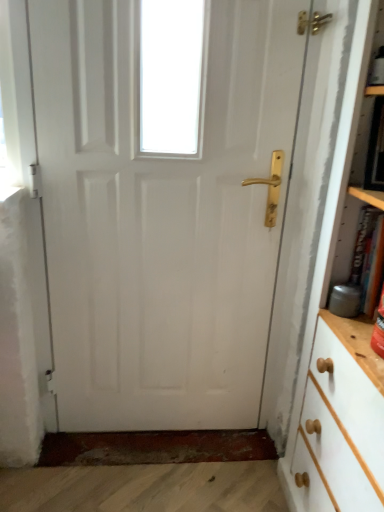
The width and height of the screenshot is (384, 512). What do you see at coordinates (339, 350) in the screenshot?
I see `white painted wood bookcase at right` at bounding box center [339, 350].

The image size is (384, 512). Identify the location of white painted wood bookcase at right. (339, 350).

Would you say white glossy door at center contains white painted wood bookcase at right?

Actually, white painted wood bookcase at right is outside white glossy door at center.

Looking at this image, from the image's perspective, does white glossy door at center appear higher than white painted wood bookcase at right?

Yes.

Is white glossy door at center not near white painted wood bookcase at right?

No, white glossy door at center is in close proximity to white painted wood bookcase at right.

How distant is white glossy door at center from white painted wood bookcase at right?

They are 19.38 inches apart.

The height and width of the screenshot is (512, 384). I want to click on door behind the white painted wood bookcase at right, so click(x=164, y=202).

Can you see white painted wood bookcase at right touching white glossy door at center?

white painted wood bookcase at right and white glossy door at center are clearly separated.

From the picture: Which object is wider, white painted wood bookcase at right or white glossy door at center?

white painted wood bookcase at right.

Can you confirm if white painted wood bookcase at right is smaller than white glossy door at center?

No, white painted wood bookcase at right is not smaller than white glossy door at center.

Which of these two, white glossy door at center or hardcover book at right, is thinner?

white glossy door at center.

Is point (205, 317) positioned after point (353, 275)?

Yes, it is behind point (353, 275).

Is white glossy door at center at the left side of hardcover book at right?

Indeed, white glossy door at center is positioned on the left side of hardcover book at right.

Which of these two, white glossy door at center or hardcover book at right, is smaller?

With smaller size is hardcover book at right.

Is hardcover book at right in front of white glossy door at center?

Yes, hardcover book at right is closer to the viewer.

In the scene shown: From a real-world perspective, is hardcover book at right positioned above or below white glossy door at center?

hardcover book at right is above white glossy door at center.

From the image's perspective, which is below, hardcover book at right or white glossy door at center?

hardcover book at right appears lower in the image.

Does hardcover book at right have a larger size compared to white glossy door at center?

Incorrect, hardcover book at right is not larger than white glossy door at center.

Which is less distant, [303,435] or [363,297]?

The point [363,297] is closer.

From a real-world perspective, does white painted wood bookcase at right sit lower than hardcover book at right?

Yes, from a real-world perspective, white painted wood bookcase at right is under hardcover book at right.

From the image's perspective, which is below, white painted wood bookcase at right or hardcover book at right?

From the image's view, white painted wood bookcase at right is below.

Consider the image. Measure the distance between hardcover book at right and white painted wood bookcase at right.

A distance of 9.62 inches exists between hardcover book at right and white painted wood bookcase at right.

In terms of height, does hardcover book at right look taller or shorter compared to white painted wood bookcase at right?

Considering their sizes, hardcover book at right has less height than white painted wood bookcase at right.

Where is `bookcase located underneath the hardcover book at right (from a real-world perspective)`? The height and width of the screenshot is (512, 384). bookcase located underneath the hardcover book at right (from a real-world perspective) is located at coordinates (339, 350).

From a real-world perspective, who is located lower, hardcover book at right or white painted wood bookcase at right?

white painted wood bookcase at right, from a real-world perspective.

Where is `bookcase on the right side of white glossy door at center`? The height and width of the screenshot is (512, 384). bookcase on the right side of white glossy door at center is located at coordinates (339, 350).

In the image, there is a white glossy door at center. Identify the location of bookcase below it (from the image's perspective). The height and width of the screenshot is (512, 384). (339, 350).

Which object lies further to the anchor point hardcover book at right, white painted wood bookcase at right or white glossy door at center?

Based on the image, white glossy door at center appears to be further to hardcover book at right.

Based on their spatial positions, is hardcover book at right or white glossy door at center further from white painted wood bookcase at right?

The object further to white painted wood bookcase at right is white glossy door at center.

Based on their spatial positions, is white glossy door at center or hardcover book at right further from white painted wood bookcase at right?

Among the two, white glossy door at center is located further to white painted wood bookcase at right.

Which object lies nearer to the anchor point white glossy door at center, white painted wood bookcase at right or hardcover book at right?

Based on the image, white painted wood bookcase at right appears to be nearer to white glossy door at center.

Based on their spatial positions, is hardcover book at right or white painted wood bookcase at right further from white glossy door at center?

hardcover book at right is positioned further to the anchor white glossy door at center.

Looking at the image, which one is located closer to hardcover book at right, white glossy door at center or white painted wood bookcase at right?

The object closer to hardcover book at right is white painted wood bookcase at right.

Locate an element on the screen. book located between white glossy door at center and white painted wood bookcase at right in the left-right direction is located at coordinates (368, 257).